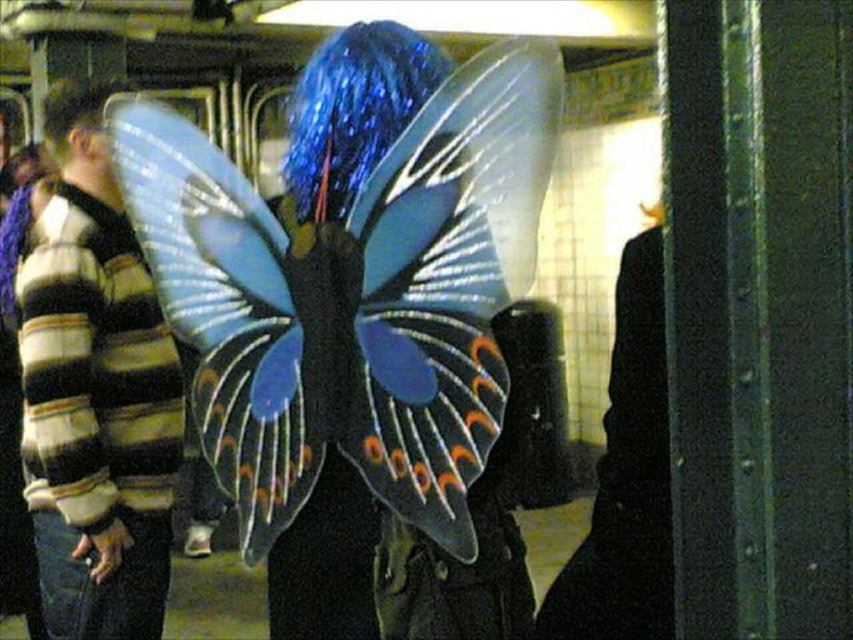
You are a photographer trying to capture a clear shot of both the shiny blue hair at center and the blue glittery hair at upper left. Which hairstyle should you focus on first to ensure it stays in frame, considering their positions?

The shiny blue hair at center is much taller than the blue glittery hair at upper left, so focusing on the shiny blue hair at center first would ensure it stays in frame due to its prominent position.

You are an artist creating a painting of the subway station scene. You want to place the striped wool sweater at left and the shiny blue hair at center in your artwork. According to the scene, which object should be placed to the left of the other?

The striped wool sweater at left is positioned on the left side of shiny blue hair at center, so the striped wool sweater at left should be placed to the left of the shiny blue hair at center in the artwork.

You are standing at point (422, 92) and want to walk to point (51, 468). Is the path directly between these two points clear of any obstacles?

Point (51, 468) is behind point (422, 92), so the path between them may be blocked by objects in front of point (422, 92). Check for obstacles before proceeding.